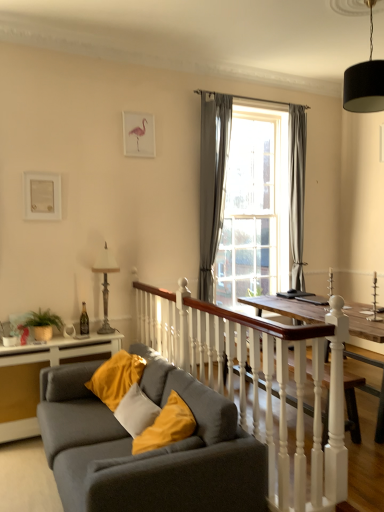
Measure the distance between point (366, 71) and camera.

A distance of 10.16 feet exists between point (366, 71) and camera.

How much space does gray fabric curtain at center, arranged as the second curtain when viewed from the right, occupy vertically?

gray fabric curtain at center, arranged as the second curtain when viewed from the right, is 7.41 feet in height.

This screenshot has height=512, width=384. What do you see at coordinates (258, 381) in the screenshot?
I see `white wooden balustrade at center` at bounding box center [258, 381].

What do you see at coordinates (150, 451) in the screenshot? I see `matte gray couch at lower left` at bounding box center [150, 451].

Find the location of a particular element. The height and width of the screenshot is (512, 384). matte gray couch at lower left is located at coordinates (150, 451).

Locate an element on the screen. black fabric lampshade at upper right is located at coordinates (365, 81).

From the picture: From the image's perspective, would you say gray fabric curtain at center, arranged as the 1th curtain when viewed from the left, is positioned over light gray fabric curtain at center, which ranks as the 2th curtain in left-to-right order?

No, from the image's perspective, gray fabric curtain at center, arranged as the 1th curtain when viewed from the left, is not on top of light gray fabric curtain at center, which ranks as the 2th curtain in left-to-right order.

Considering the positions of point (209, 201) and point (290, 236), is point (209, 201) closer or farther from the camera than point (290, 236)?

Point (209, 201) is closer to the camera than point (290, 236).

Is gray fabric curtain at center, the second curtain from the back, bigger or smaller than light gray fabric curtain at center, which appears as the 1th curtain when viewed from the back?

gray fabric curtain at center, the second curtain from the back, is bigger than light gray fabric curtain at center, which appears as the 1th curtain when viewed from the back.

How distant is gray fabric curtain at center, the 1th curtain positioned from the front, from light gray fabric curtain at center, which appears as the 1th curtain when viewed from the back?

A distance of 3.91 feet exists between gray fabric curtain at center, the 1th curtain positioned from the front, and light gray fabric curtain at center, which appears as the 1th curtain when viewed from the back.

Is gray fabric curtain at center, the 1th curtain positioned from the front, located outside metallic silver lamp at left?

That's correct, gray fabric curtain at center, the 1th curtain positioned from the front, is outside of metallic silver lamp at left.

Identify the location of curtain that is the 1st object to the right of the metallic silver lamp at left, starting at the anchor. (212, 181).

Does point (210, 182) lie behind point (110, 262)?

Yes, point (210, 182) is behind point (110, 262).

What's the angular difference between gray fabric curtain at center, arranged as the second curtain when viewed from the right, and metallic silver lamp at left's facing directions?

The angular difference between gray fabric curtain at center, arranged as the second curtain when viewed from the right, and metallic silver lamp at left is 0.0122 degrees.

Is light gray fabric curtain at center, which ranks as the 2th curtain in left-to-right order, located outside gray fabric curtain at center, arranged as the second curtain when viewed from the right?

light gray fabric curtain at center, which ranks as the 2th curtain in left-to-right order, is positioned outside gray fabric curtain at center, arranged as the second curtain when viewed from the right.

Measure the distance between light gray fabric curtain at center, which appears as the 1th curtain when viewed from the back, and gray fabric curtain at center, arranged as the second curtain when viewed from the right.

A distance of 3.91 feet exists between light gray fabric curtain at center, which appears as the 1th curtain when viewed from the back, and gray fabric curtain at center, arranged as the second curtain when viewed from the right.

Can you confirm if light gray fabric curtain at center, which appears as the 1th curtain when viewed from the back, is positioned to the left of gray fabric curtain at center, arranged as the second curtain when viewed from the right?

No, light gray fabric curtain at center, which appears as the 1th curtain when viewed from the back, is not to the left of gray fabric curtain at center, arranged as the second curtain when viewed from the right.

Considering the sizes of light gray fabric curtain at center, which ranks as the 2th curtain in left-to-right order, and gray fabric curtain at center, arranged as the second curtain when viewed from the right, in the image, is light gray fabric curtain at center, which ranks as the 2th curtain in left-to-right order, wider or thinner than gray fabric curtain at center, arranged as the second curtain when viewed from the right,?

light gray fabric curtain at center, which ranks as the 2th curtain in left-to-right order, is wider than gray fabric curtain at center, arranged as the second curtain when viewed from the right.

Is black fabric lampshade at upper right aimed at metallic silver lamp at left?

No.

Find the location of a particular element. Image resolution: width=384 pixels, height=512 pixels. light fixture above the metallic silver lamp at left (from the image's perspective) is located at coordinates (365, 81).

Can you tell me how much black fabric lampshade at upper right and metallic silver lamp at left differ in facing direction?

The angular difference between black fabric lampshade at upper right and metallic silver lamp at left is 81.2 degrees.

How much distance is there between black fabric lampshade at upper right and metallic silver lamp at left?

black fabric lampshade at upper right and metallic silver lamp at left are 8.49 feet apart.

From the image's perspective, which one is positioned higher, matte gray couch at lower left or black fabric lampshade at upper right?

From the image's view, black fabric lampshade at upper right is above.

Based on the photo, is matte gray couch at lower left at the left side of black fabric lampshade at upper right?

Yes, matte gray couch at lower left is to the left of black fabric lampshade at upper right.

Is matte gray couch at lower left directly adjacent to black fabric lampshade at upper right?

No, matte gray couch at lower left is not touching black fabric lampshade at upper right.

Find the location of `studio couch in front of the white matte picture frame at upper left, which is the 2th picture frame in right-to-left order`. studio couch in front of the white matte picture frame at upper left, which is the 2th picture frame in right-to-left order is located at coordinates (150, 451).

Considering the relative positions of white matte picture frame at upper left, which is the 2th picture frame from back to front, and matte gray couch at lower left in the image provided, is white matte picture frame at upper left, which is the 2th picture frame from back to front, to the left of matte gray couch at lower left from the viewer's perspective?

Yes, white matte picture frame at upper left, which is the 2th picture frame from back to front, is to the left of matte gray couch at lower left.

Is white matte picture frame at upper left, positioned as the first picture frame in left-to-right order, next to matte gray couch at lower left and touching it?

No, white matte picture frame at upper left, positioned as the first picture frame in left-to-right order, is not touching matte gray couch at lower left.

Which of these two, white matte picture frame at upper left, which is the 2th picture frame from back to front, or matte gray couch at lower left, is smaller?

white matte picture frame at upper left, which is the 2th picture frame from back to front.

How many degrees apart are the facing directions of white matte picture frame at upper left, acting as the 1th picture frame starting from the front, and black fabric lampshade at upper right?

The facing directions of white matte picture frame at upper left, acting as the 1th picture frame starting from the front, and black fabric lampshade at upper right are 81.2 degrees apart.

Is white matte picture frame at upper left, the 1th picture frame from the bottom, to the right of black fabric lampshade at upper right from the viewer's perspective?

No, white matte picture frame at upper left, the 1th picture frame from the bottom, is not to the right of black fabric lampshade at upper right.

Is white matte picture frame at upper left, which is the 2th picture frame in right-to-left order, wider than black fabric lampshade at upper right?

No, white matte picture frame at upper left, which is the 2th picture frame in right-to-left order, is not wider than black fabric lampshade at upper right.

Is white matte picture frame at upper left, which is counted as the second picture frame, starting from the top, shorter than black fabric lampshade at upper right?

Indeed, white matte picture frame at upper left, which is counted as the second picture frame, starting from the top, has a lesser height compared to black fabric lampshade at upper right.

You are a GUI agent. You are given a task and a screenshot of the screen. Output one action in this format:
    pyautogui.click(x=<x>, y=<y>)
    Task: Click on the curtain to the right of gray fabric curtain at center, arranged as the 1th curtain when viewed from the left
    Image resolution: width=384 pixels, height=512 pixels.
    Given the screenshot: What is the action you would take?
    pyautogui.click(x=297, y=192)

Image resolution: width=384 pixels, height=512 pixels. Find the location of `lamp below the gray fabric curtain at center, arranged as the 1th curtain when viewed from the left (from a real-world perspective)`. lamp below the gray fabric curtain at center, arranged as the 1th curtain when viewed from the left (from a real-world perspective) is located at coordinates (105, 283).

Considering their positions, is light gray fabric curtain at center, which ranks as the 2th curtain in left-to-right order, positioned further to black fabric lampshade at upper right than white matte picture frame at upper left, positioned as the first picture frame in left-to-right order?

white matte picture frame at upper left, positioned as the first picture frame in left-to-right order, lies further to black fabric lampshade at upper right than the other object.

Looking at the image, which one is located closer to gray fabric curtain at center, arranged as the second curtain when viewed from the right, matte gray couch at lower left or light gray fabric curtain at center, which is the second curtain in front-to-back order?

The object closer to gray fabric curtain at center, arranged as the second curtain when viewed from the right, is light gray fabric curtain at center, which is the second curtain in front-to-back order.

In the scene shown: Which object lies further to the anchor point white matte picture frame at upper left, which is the 2th picture frame from back to front, light gray fabric curtain at center, which is the second curtain in front-to-back order, or pink paper picture frame at upper center, which ranks as the second picture frame in front-to-back order?

Among the two, light gray fabric curtain at center, which is the second curtain in front-to-back order, is located further to white matte picture frame at upper left, which is the 2th picture frame from back to front.

Estimate the real-world distances between objects in this image. Which object is closer to pink paper picture frame at upper center, the 1th picture frame viewed from the back, black fabric lampshade at upper right or gray fabric curtain at center, arranged as the second curtain when viewed from the right?

gray fabric curtain at center, arranged as the second curtain when viewed from the right, is closer to pink paper picture frame at upper center, the 1th picture frame viewed from the back.

Which object lies nearer to the anchor point black fabric lampshade at upper right, white matte picture frame at upper left, which is counted as the second picture frame, starting from the top, or matte gray couch at lower left?

matte gray couch at lower left is positioned closer to the anchor black fabric lampshade at upper right.

Considering their positions, is metallic silver lamp at left positioned closer to black fabric lampshade at upper right than wooden table at lower left?

The object closer to black fabric lampshade at upper right is metallic silver lamp at left.

Estimate the real-world distances between objects in this image. Which object is further from black fabric lampshade at upper right, matte gray couch at lower left or gray fabric curtain at center, the second curtain from the back?

matte gray couch at lower left lies further to black fabric lampshade at upper right than the other object.

Considering their positions, is black fabric lampshade at upper right positioned closer to pink paper picture frame at upper center, arranged as the 2th picture frame when viewed from the left, than matte gray couch at lower left?

The object closer to pink paper picture frame at upper center, arranged as the 2th picture frame when viewed from the left, is black fabric lampshade at upper right.

Image resolution: width=384 pixels, height=512 pixels. What are the coordinates of `table located between white wooden balustrade at center and white matte picture frame at upper left, which is the 2th picture frame in right-to-left order, in the depth direction` in the screenshot? It's located at (61, 349).

Find the location of a particular element. curtain located between pink paper picture frame at upper center, which appears as the 1th picture frame when viewed from the right, and light gray fabric curtain at center, which ranks as the 2th curtain in left-to-right order, in the left-right direction is located at coordinates 212,181.

Image resolution: width=384 pixels, height=512 pixels. I want to click on table positioned between matte gray couch at lower left and light gray fabric curtain at center, which is the second curtain in front-to-back order, from near to far, so click(x=61, y=349).

Image resolution: width=384 pixels, height=512 pixels. What are the coordinates of `balustrade between black fabric lampshade at upper right and wooden table at lower left in the vertical direction` in the screenshot? It's located at (258, 381).